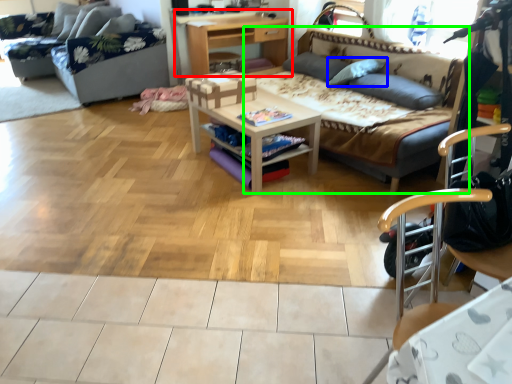
Question: Considering the real-world distances, which object is farthest from desk (highlighted by a red box)? pillow (highlighted by a blue box) or studio couch (highlighted by a green box)?

Choices:
 (A) pillow
 (B) studio couch

Answer: (A)